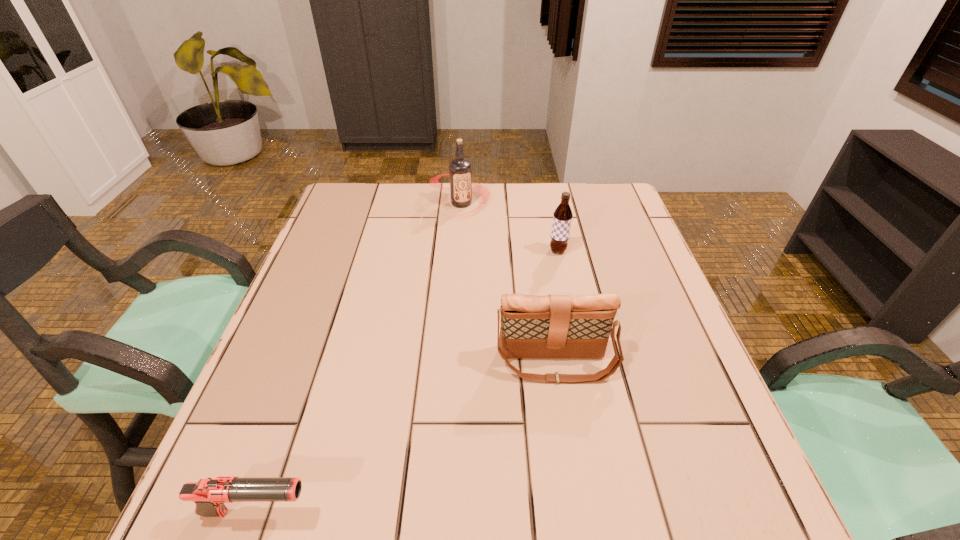
Locate an element on the screen. The image size is (960, 540). the farther root beer is located at coordinates (460, 171).

Locate an element on the screen. The width and height of the screenshot is (960, 540). the third object from right to left is located at coordinates (460, 171).

Locate an element on the screen. The height and width of the screenshot is (540, 960). the second farthest object is located at coordinates (562, 217).

The height and width of the screenshot is (540, 960). Identify the location of the right root beer. (562, 217).

Find the location of a particular element. This screenshot has height=540, width=960. the second nearest object is located at coordinates (553, 326).

This screenshot has width=960, height=540. I want to click on the leftmost object, so click(209, 495).

Locate an element on the screen. This screenshot has width=960, height=540. gun is located at coordinates (209, 495).

Where is `free location located 0.150m on the label of the farther root beer`? Image resolution: width=960 pixels, height=540 pixels. free location located 0.150m on the label of the farther root beer is located at coordinates (459, 252).

The height and width of the screenshot is (540, 960). I want to click on vacant space located on the left of the nearer root beer, so click(x=530, y=251).

You are a GUI agent. You are given a task and a screenshot of the screen. Output one action in this format:
    pyautogui.click(x=<x>, y=<y>)
    Task: Click on the free space located on the front-facing side of the second nearest object
    The height and width of the screenshot is (540, 960).
    Given the screenshot: What is the action you would take?
    pyautogui.click(x=563, y=407)